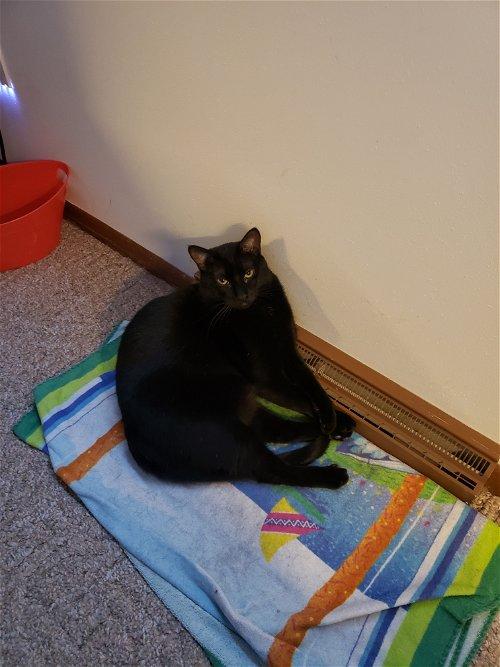
Find the location of a particular element. Image resolution: width=500 pixels, height=667 pixels. wall is located at coordinates (325, 69).